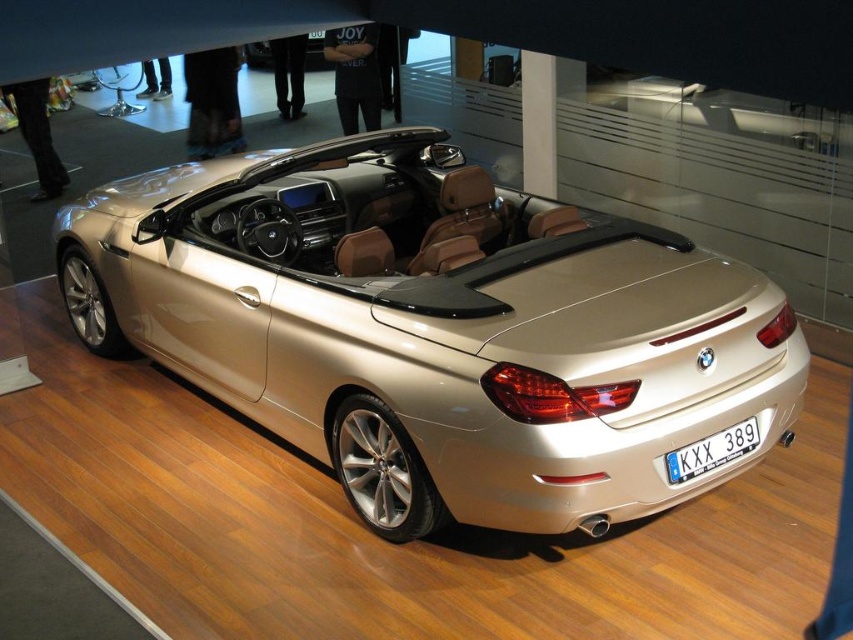
Between metallic gold convertible at center and white plastic license plate at center, which one has more height?

Standing taller between the two is metallic gold convertible at center.

Is point (375, 145) closer to camera compared to point (747, 442)?

That is False.

At what (x,y) coordinates should I click in order to perform the action: click on metallic gold convertible at center. Please return your answer as a coordinate pair (x, y). This screenshot has width=853, height=640. Looking at the image, I should click on (436, 330).